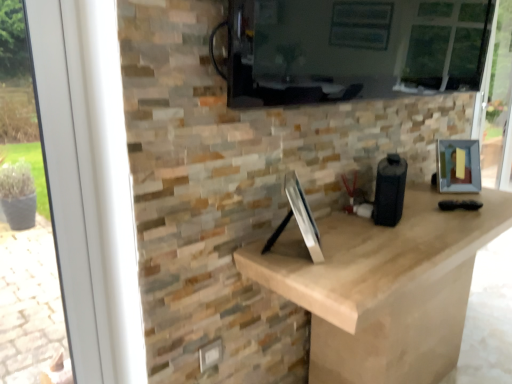
Question: From the image's perspective, is metallic silver picture frame at right beneath matte black screen at upper center?

Choices:
 (A) yes
 (B) no

Answer: (A)

Question: Is metallic silver picture frame at right next to matte black screen at upper center and touching it?

Choices:
 (A) yes
 (B) no

Answer: (B)

Question: Is metallic silver picture frame at right positioned with its back to matte black screen at upper center?

Choices:
 (A) no
 (B) yes

Answer: (A)

Question: Are metallic silver picture frame at right and matte black screen at upper center located far from each other?

Choices:
 (A) no
 (B) yes

Answer: (A)

Question: Could you tell me if metallic silver picture frame at right is facing matte black screen at upper center?

Choices:
 (A) no
 (B) yes

Answer: (A)

Question: Relative to matte black screen at upper center, is metallic silver picture frame at right in front or behind?

Choices:
 (A) behind
 (B) front

Answer: (A)

Question: Do you think metallic silver picture frame at right is within matte black screen at upper center, or outside of it?

Choices:
 (A) outside
 (B) inside

Answer: (A)

Question: Based on their positions, is metallic silver picture frame at right located to the left or right of matte black screen at upper center?

Choices:
 (A) right
 (B) left

Answer: (A)

Question: From the image's perspective, is metallic silver picture frame at right positioned above or below matte black screen at upper center?

Choices:
 (A) above
 (B) below

Answer: (B)

Question: Considering the positions of white plastic window frame at left and metallic silver picture frame at right in the image, is white plastic window frame at left wider or thinner than metallic silver picture frame at right?

Choices:
 (A) wide
 (B) thin

Answer: (B)

Question: Does point (104, 196) appear closer or farther from the camera than point (459, 148)?

Choices:
 (A) closer
 (B) farther

Answer: (A)

Question: In terms of size, does white plastic window frame at left appear bigger or smaller than metallic silver picture frame at right?

Choices:
 (A) small
 (B) big

Answer: (B)

Question: In the image, is white plastic window frame at left positioned in front of or behind metallic silver picture frame at right?

Choices:
 (A) behind
 (B) front

Answer: (B)

Question: Considering the positions of matte black screen at upper center and metallic silver picture frame at right in the image, is matte black screen at upper center wider or thinner than metallic silver picture frame at right?

Choices:
 (A) wide
 (B) thin

Answer: (B)

Question: Do you think matte black screen at upper center is within metallic silver picture frame at right, or outside of it?

Choices:
 (A) inside
 (B) outside

Answer: (B)